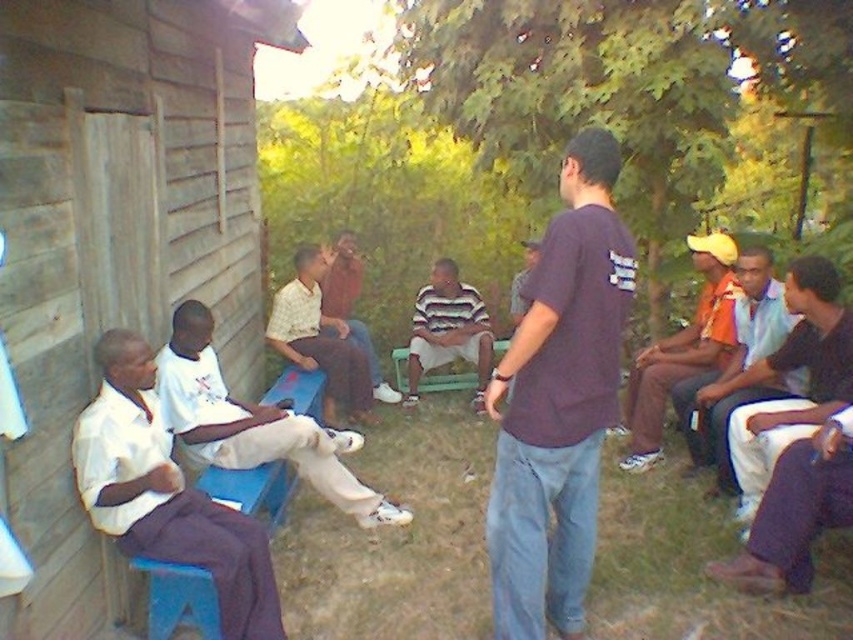
Question: Which object is positioned closest to the light brown fabric shirt at center?

Choices:
 (A) orange shirt at center
 (B) orange fabric shirt at right
 (C) white cotton shirt at left

Answer: (C)

Question: Which of these objects is positioned closest to the light brown fabric shirt at center?

Choices:
 (A) orange fabric shirt at right
 (B) white cotton shirt at left

Answer: (B)

Question: Is the position of white matte shirt at left more distant than that of light brown fabric shirt at center?

Choices:
 (A) yes
 (B) no

Answer: (B)

Question: Does dark purple t-shirt at center appear under light brown fabric shirt at center?

Choices:
 (A) yes
 (B) no

Answer: (A)

Question: Is orange fabric shirt at right to the right of brown leather jacket at center from the viewer's perspective?

Choices:
 (A) no
 (B) yes

Answer: (B)

Question: Which point is closer to the camera taking this photo?

Choices:
 (A) (491, 340)
 (B) (28, 168)

Answer: (B)